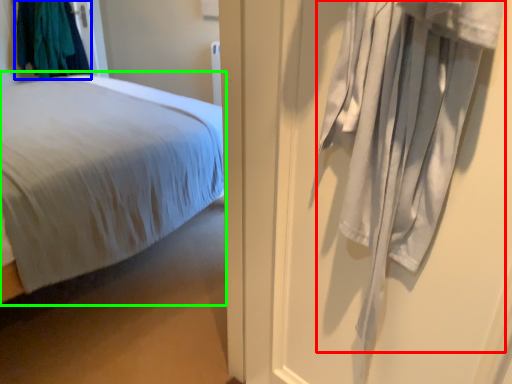
Question: Based on their relative distances, which object is farther from curtain (highlighted by a red box)? Choose from clothing (highlighted by a blue box) and bed (highlighted by a green box).

Choices:
 (A) clothing
 (B) bed

Answer: (A)